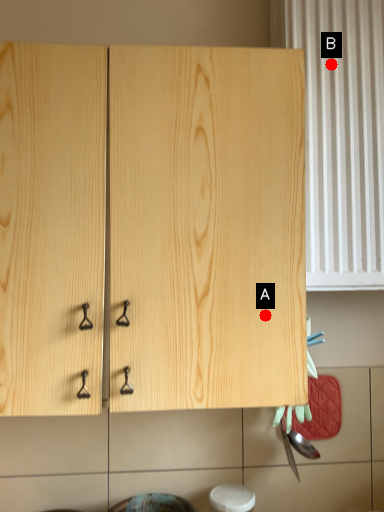
Question: Two points are circled on the image, labeled by A and B beside each circle. Which point is further to the camera?

Choices:
 (A) A is further
 (B) B is further

Answer: (B)